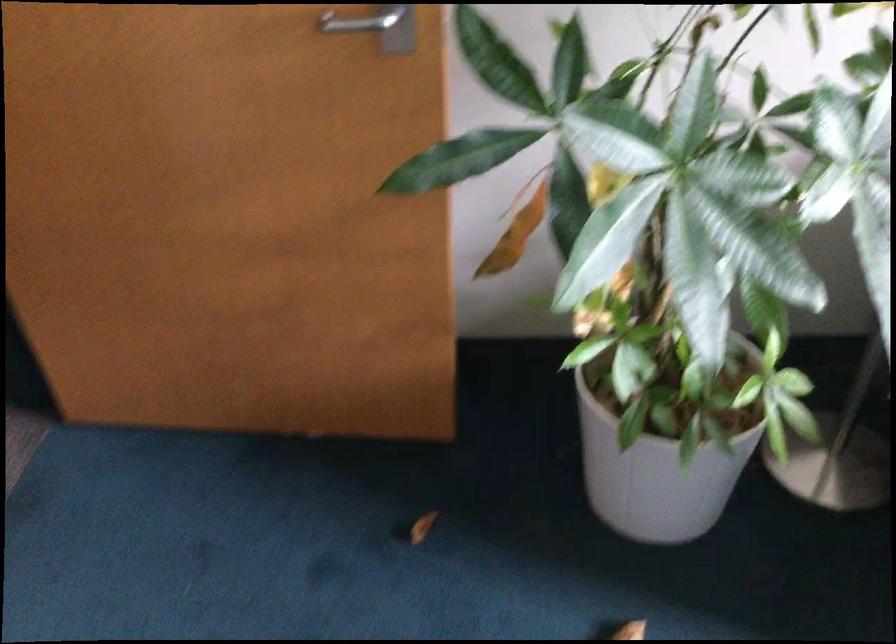
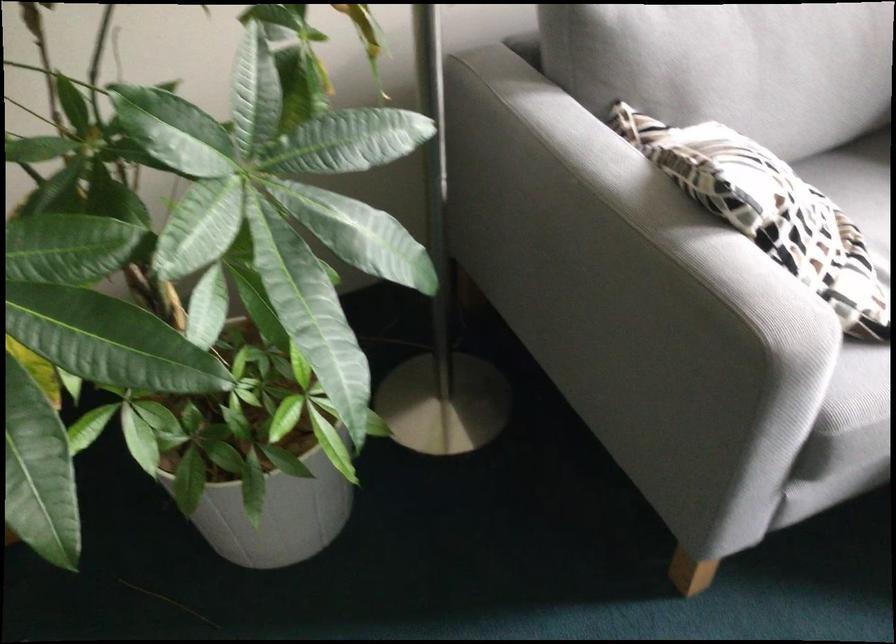
Which direction would the cameraman need to move to produce the second image?

The cameraman walked toward right, forward.